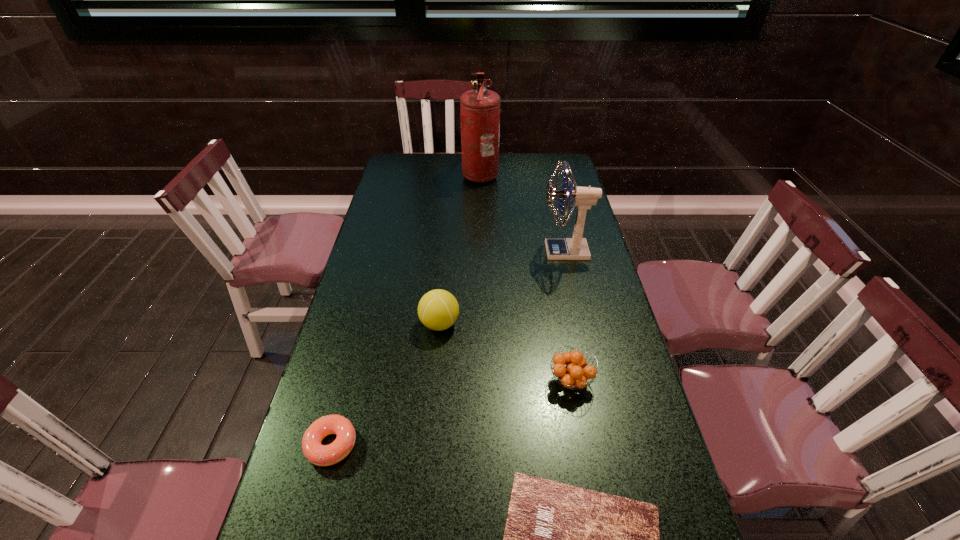
What are the coordinates of `the tallest object` in the screenshot? It's located at (480, 108).

This screenshot has width=960, height=540. Find the location of `fire extinguisher`. fire extinguisher is located at coordinates (480, 108).

Identify the location of the fifth shortest object. (575, 248).

The height and width of the screenshot is (540, 960). Find the location of `fan`. fan is located at coordinates (575, 248).

Find the location of a particular element. the fourth shortest object is located at coordinates (438, 309).

The image size is (960, 540). In order to click on tennis ball in this screenshot , I will do `click(438, 309)`.

Where is `the fourth farthest object`? The image size is (960, 540). the fourth farthest object is located at coordinates (575, 374).

Where is `orange fruit`? Image resolution: width=960 pixels, height=540 pixels. orange fruit is located at coordinates [575, 374].

This screenshot has width=960, height=540. Identify the location of the leftmost object. (321, 455).

Find the location of a particular element. the fifth farthest object is located at coordinates (321, 455).